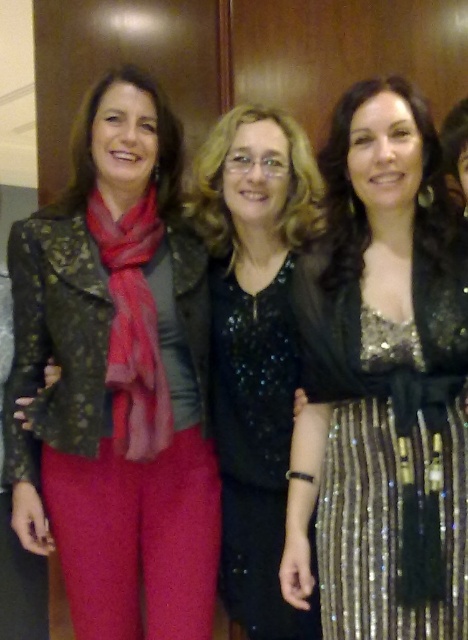
Question: Where is matte black jacket at left located in relation to sequined gold dress at center in the image?

Choices:
 (A) right
 (B) left

Answer: (B)

Question: Which of these objects is positioned closest to the sequined gold dress at center?

Choices:
 (A) black sequined dress at center
 (B) matte black jacket at left

Answer: (A)

Question: Is matte black jacket at left to the right of sequined gold dress at center from the viewer's perspective?

Choices:
 (A) yes
 (B) no

Answer: (B)

Question: Which object is positioned farthest from the sequined gold dress at center?

Choices:
 (A) black sequined dress at center
 (B) matte black jacket at left

Answer: (B)

Question: Which of these objects is positioned farthest from the black sequined dress at center?

Choices:
 (A) sequined gold dress at center
 (B) matte black jacket at left

Answer: (A)

Question: Is matte black jacket at left closer to the viewer compared to black sequined dress at center?

Choices:
 (A) no
 (B) yes

Answer: (B)